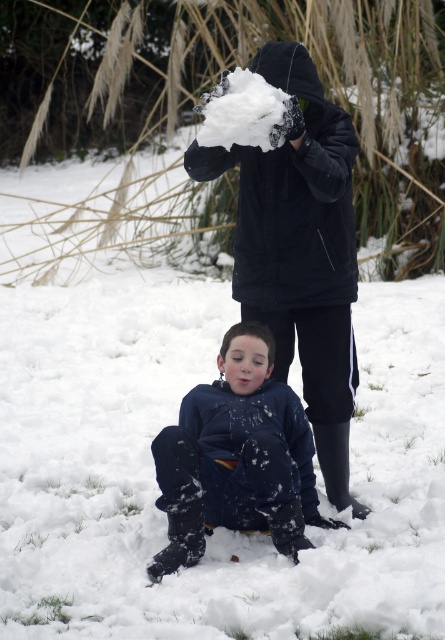
Question: Does matte black jacket at upper center appear on the right side of dark blue fleece at lower center?

Choices:
 (A) no
 (B) yes

Answer: (B)

Question: Does matte black jacket at upper center have a greater width compared to dark blue fleece at lower center?

Choices:
 (A) yes
 (B) no

Answer: (B)

Question: Which point is closer to the camera?

Choices:
 (A) matte black jacket at upper center
 (B) dark blue fleece at lower center

Answer: (B)

Question: Can you confirm if matte black jacket at upper center is bigger than dark blue fleece at lower center?

Choices:
 (A) yes
 (B) no

Answer: (A)